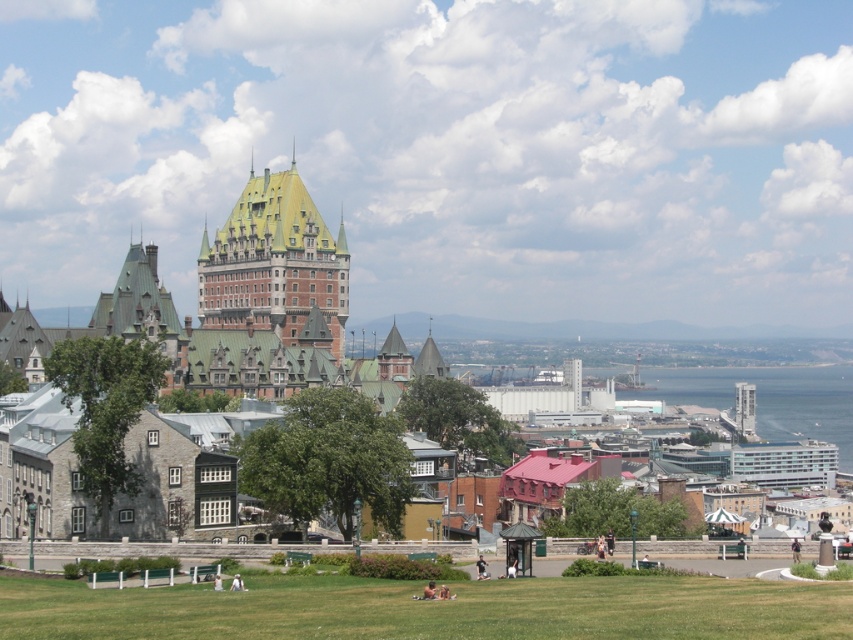
You are a tourist standing at the base of the Chateu Frontenac. You want to find a spot to take a photo that includes both the green grassy field at lower center and the stone building at center. Which object should you position yourself closer to in order to capture both in your frame?

To capture both the green grassy field at lower center and the stone building at center in your photo, you should position yourself closer to the green grassy field at lower center since it is positioned under the stone building at center, allowing both to be in the same frame when the camera is angled upwards.

You are standing at the viewpoint where the image was taken and want to take a photo of both the Chateu Frontenac and a specific point. If you have to focus your camera on one of the two points, point 1 at coordinates point (396, 371) or point 2 at coordinates point (320, 282), which point should you focus on to ensure both the Chateu Frontenac and the point are in focus?

You should focus on point 1 at coordinates point (396, 371) because it is closer to the camera than point 2 at coordinates point (320, 282). By focusing on the closer point, the depth of field will extend further back, increasing the likelihood that both the Chateu Frontenac and the point are in focus.

You are standing in the historic cityscape with the Chateu Frontenac in the background. You see the green grassy field at lower center and the blue glass water at lower right. Which object is closer to you?

The green grassy field at lower center is closer to you because it is in front of the blue glass water at lower right.